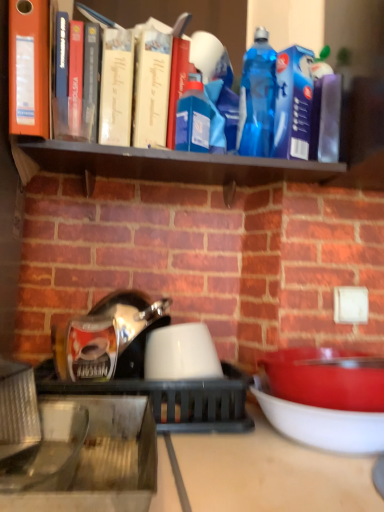
Question: From the image's perspective, is black matte shelf at upper center on matte white bowl at lower right, which is the 3th bowl from left to right?

Choices:
 (A) yes
 (B) no

Answer: (A)

Question: Would you consider black matte shelf at upper center to be distant from matte white bowl at lower right, the 1th bowl when ordered from right to left?

Choices:
 (A) no
 (B) yes

Answer: (A)

Question: Is black matte shelf at upper center at the left side of matte white bowl at lower right, the 1th bowl when ordered from right to left?

Choices:
 (A) yes
 (B) no

Answer: (A)

Question: Can you confirm if black matte shelf at upper center is shorter than matte white bowl at lower right, which is the 3th bowl from left to right?

Choices:
 (A) no
 (B) yes

Answer: (B)

Question: Can you confirm if black matte shelf at upper center is bigger than matte white bowl at lower right, which is the 3th bowl from left to right?

Choices:
 (A) no
 (B) yes

Answer: (A)

Question: Is black matte shelf at upper center with matte white bowl at lower right, which is the 3th bowl from left to right?

Choices:
 (A) no
 (B) yes

Answer: (A)

Question: Can you confirm if white glossy kettle at center is shorter than matte white bowl at lower right, which is the 3th bowl from left to right?

Choices:
 (A) no
 (B) yes

Answer: (A)

Question: Is white glossy kettle at center not within matte white bowl at lower right, the 1th bowl when ordered from right to left?

Choices:
 (A) no
 (B) yes

Answer: (B)

Question: Is white glossy kettle at center touching matte white bowl at lower right, which is the 3th bowl from left to right?

Choices:
 (A) no
 (B) yes

Answer: (A)

Question: Could you tell me if white glossy kettle at center is turned towards matte white bowl at lower right, which is the 3th bowl from left to right?

Choices:
 (A) no
 (B) yes

Answer: (A)

Question: Is white glossy kettle at center further to camera compared to matte white bowl at lower right, the 1th bowl when ordered from right to left?

Choices:
 (A) yes
 (B) no

Answer: (A)

Question: From the image's perspective, is white glossy kettle at center located above matte white bowl at lower right, which is the 3th bowl from left to right?

Choices:
 (A) yes
 (B) no

Answer: (A)

Question: Does matte white bowl at lower right, the 1th bowl when ordered from right to left, have a larger size compared to black matte shelf at upper center?

Choices:
 (A) yes
 (B) no

Answer: (A)